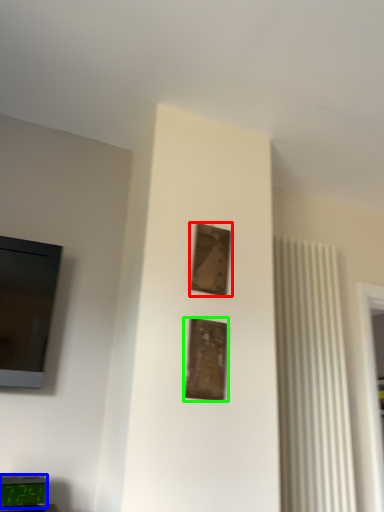
Question: Estimate the real-world distances between objects in this image. Which object is closer to picture frame (highlighted by a red box), alarm clock (highlighted by a blue box) or picture frame (highlighted by a green box)?

Choices:
 (A) alarm clock
 (B) picture frame

Answer: (B)